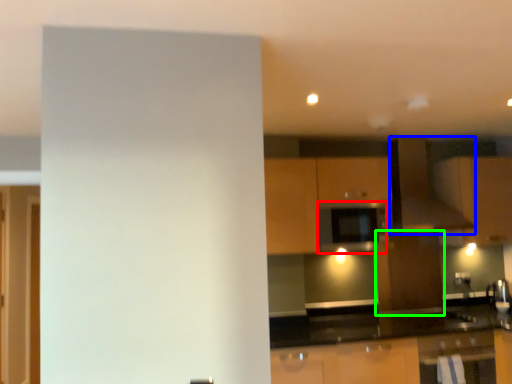
Question: Estimate the real-world distances between objects in this image. Which object is closer to appliance (highlighted by a red box), exhaust hood (highlighted by a blue box) or cabinetry (highlighted by a green box)?

Choices:
 (A) exhaust hood
 (B) cabinetry

Answer: (A)